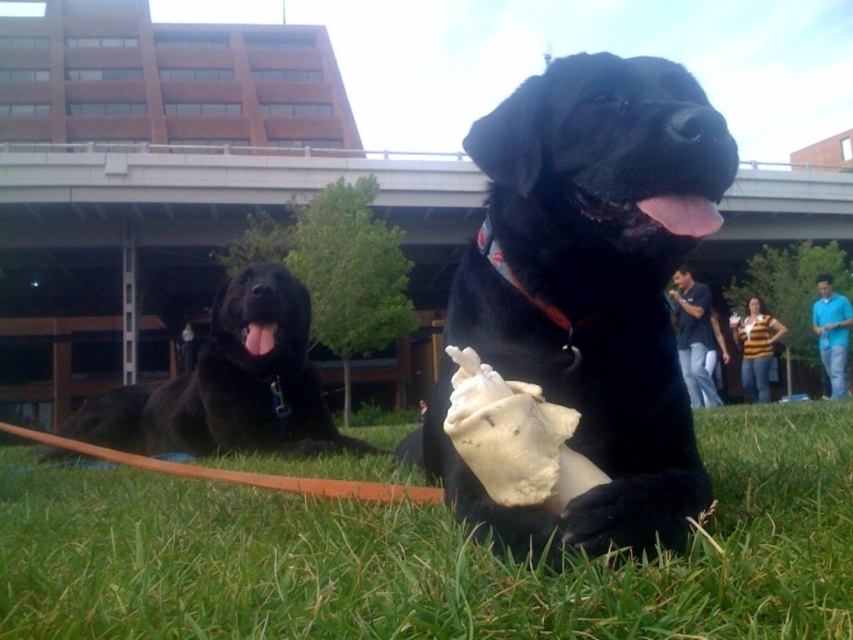
Which of these two, green grass at lower center or black matte dog at center, stands taller?

black matte dog at center is taller.

Which is behind, point (380, 435) or point (614, 228)?

The point (380, 435) is behind.

This screenshot has height=640, width=853. In order to click on green grass at lower center in this screenshot , I will do `click(427, 554)`.

Who is positioned more to the right, green grass at lower center or black matte dog at left?

From the viewer's perspective, green grass at lower center appears more on the right side.

Is the position of green grass at lower center less distant than that of black matte dog at left?

Yes, green grass at lower center is in front of black matte dog at left.

Locate an element on the screen. The image size is (853, 640). green grass at lower center is located at coordinates (427, 554).

The image size is (853, 640). Identify the location of green grass at lower center. (427, 554).

Can you confirm if black matte dog at center is taller than black matte dog at left?

Yes, black matte dog at center is taller than black matte dog at left.

Who is lower down, black matte dog at center or black matte dog at left?

black matte dog at left is lower down.

Where is `black matte dog at center`? Image resolution: width=853 pixels, height=640 pixels. black matte dog at center is located at coordinates (589, 292).

Where is `black matte dog at center`? This screenshot has width=853, height=640. black matte dog at center is located at coordinates (589, 292).